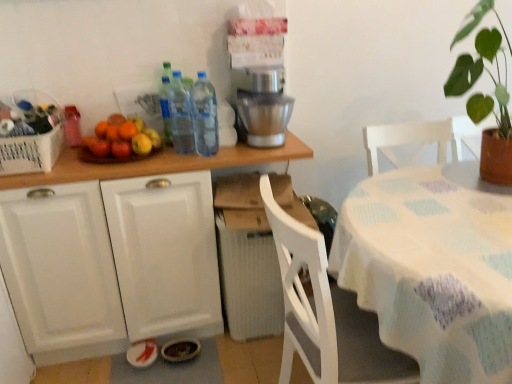
What do you see at coordinates (72, 125) in the screenshot? I see `matte glass bottle at upper left, arranged as the 3th bottle when viewed from the right` at bounding box center [72, 125].

Describe the element at coordinates (180, 116) in the screenshot. I see `translucent plastic bottles at upper center, which is the second bottle in left-to-right order` at that location.

The height and width of the screenshot is (384, 512). What do you see at coordinates (262, 105) in the screenshot?
I see `satin silver coffee machine at upper center` at bounding box center [262, 105].

The image size is (512, 384). I want to click on matte glass bottle at upper left, arranged as the 3th bottle when viewed from the right, so click(x=72, y=125).

Is point (479, 205) positioned behind point (40, 158)?

That is False.

Considering the positions of objects white fabric table at right and white woven basket at left in the image provided, who is more to the left, white fabric table at right or white woven basket at left?

Positioned to the left is white woven basket at left.

Considering the sizes of objects white fabric table at right and white woven basket at left in the image provided, who is shorter, white fabric table at right or white woven basket at left?

With less height is white woven basket at left.

From a real-world perspective, relative to white woven basket at left, is white fabric table at right vertically above or below?

Clearly, from a real-world perspective, white fabric table at right is below white woven basket at left.

Is point (237, 85) positioned in front of point (125, 158)?

No, it is behind (125, 158).

Between satin silver coffee machine at upper center and shiny plastic fruits at center left, which one is positioned behind?

satin silver coffee machine at upper center is further away from the camera.

Can you confirm if satin silver coffee machine at upper center is wider than shiny plastic fruits at center left?

Yes, satin silver coffee machine at upper center is wider than shiny plastic fruits at center left.

At what (x,y) coordinates should I click in order to perform the action: click on fruit in front of the satin silver coffee machine at upper center. Please return your answer as a coordinate pair (x, y). Looking at the image, I should click on (122, 138).

Consider the image. Is white wood cabinet at upper left in contact with transparent plastic bottle at center, the third bottle viewed from the left?

white wood cabinet at upper left is not next to transparent plastic bottle at center, the third bottle viewed from the left, and they're not touching.

Which point is more forward, [121,164] or [203,114]?

The point [121,164] is in front.

From a real-world perspective, which object stands above the other?

From a 3D spatial view, transparent plastic bottle at center, the third bottle viewed from the left, is above.

Find the location of a particular element. Image resolution: width=512 pixels, height=384 pixels. cabinetry that appears on the left of transparent plastic bottle at center, the 1th bottle viewed from the right is located at coordinates (158, 164).

Between satin silver coffee machine at upper center and matte glass bottle at upper left, marked as the first bottle in a left-to-right arrangement, which one has larger width?

satin silver coffee machine at upper center is wider.

Which object is positioned more to the right, satin silver coffee machine at upper center or matte glass bottle at upper left, marked as the first bottle in a left-to-right arrangement?

Positioned to the right is satin silver coffee machine at upper center.

Is satin silver coffee machine at upper center oriented towards matte glass bottle at upper left, marked as the first bottle in a left-to-right arrangement?

No, satin silver coffee machine at upper center is not oriented towards matte glass bottle at upper left, marked as the first bottle in a left-to-right arrangement.

Is the depth of satin silver coffee machine at upper center greater than that of matte glass bottle at upper left, arranged as the 3th bottle when viewed from the right?

No, satin silver coffee machine at upper center is in front of matte glass bottle at upper left, arranged as the 3th bottle when viewed from the right.

Can we say shiny plastic fruits at center left lies outside white wood cabinet at upper left?

Indeed, shiny plastic fruits at center left is completely outside white wood cabinet at upper left.

From the image's perspective, does shiny plastic fruits at center left appear higher than white wood cabinet at upper left?

Yes, from the image's perspective, shiny plastic fruits at center left is over white wood cabinet at upper left.

Are shiny plastic fruits at center left and white wood cabinet at upper left beside each other?

shiny plastic fruits at center left and white wood cabinet at upper left are not in contact.

From a real-world perspective, is shiny plastic fruits at center left physically below white wood cabinet at upper left?

No.

Is white fabric table at right positioned in front of transparent plastic bottle at center, the 1th bottle viewed from the right?

Yes, it is in front of transparent plastic bottle at center, the 1th bottle viewed from the right.

Considering the relative sizes of white fabric table at right and transparent plastic bottle at center, the 1th bottle viewed from the right, in the image provided, is white fabric table at right smaller than transparent plastic bottle at center, the 1th bottle viewed from the right,?

Incorrect, white fabric table at right is not smaller in size than transparent plastic bottle at center, the 1th bottle viewed from the right.

Is point (439, 352) positioned before point (214, 92)?

Yes, point (439, 352) is in front of point (214, 92).

Who is bigger, white wood cabinet at upper left or white woven basket at left?

With larger size is white wood cabinet at upper left.

Is white wood cabinet at upper left closer to camera compared to white woven basket at left?

Yes, it is.

Based on their positions, is white wood cabinet at upper left located to the left or right of white woven basket at left?

white wood cabinet at upper left is to the right of white woven basket at left.

In the scene shown: Considering the sizes of objects white wood cabinet at upper left and white woven basket at left in the image provided, who is thinner, white wood cabinet at upper left or white woven basket at left?

Thinner between the two is white woven basket at left.

The image size is (512, 384). In order to click on basket that is behind the white fabric table at right in this screenshot , I will do `click(31, 152)`.

Where is `coffee machine on the right of shiny plastic fruits at center left`? Image resolution: width=512 pixels, height=384 pixels. coffee machine on the right of shiny plastic fruits at center left is located at coordinates (262, 105).

Looking at the image, which one is located further to white fabric table at right, transparent plastic bottle at center, the 1th bottle viewed from the right, or white woven basket at left?

The object further to white fabric table at right is white woven basket at left.

Considering their positions, is matte glass bottle at upper left, marked as the first bottle in a left-to-right arrangement, positioned further to translucent plastic bottles at upper center, which is the second bottle in left-to-right order, than shiny plastic fruits at center left?

matte glass bottle at upper left, marked as the first bottle in a left-to-right arrangement, is further to translucent plastic bottles at upper center, which is the second bottle in left-to-right order.

Based on the photo, when comparing their distances from shiny plastic fruits at center left, does satin silver coffee machine at upper center or white wood cabinet at upper left seem closer?

white wood cabinet at upper left is positioned closer to the anchor shiny plastic fruits at center left.

Considering their positions, is translucent plastic bottles at upper center, which is the second bottle in left-to-right order, positioned further to white fabric table at right than transparent plastic bottle at center, the third bottle viewed from the left?

translucent plastic bottles at upper center, which is the second bottle in left-to-right order, is positioned further to the anchor white fabric table at right.

From the image, which object appears to be nearer to matte glass bottle at upper left, marked as the first bottle in a left-to-right arrangement, white fabric table at right or white woven basket at left?

white woven basket at left.

When comparing their distances from satin silver coffee machine at upper center, does matte glass bottle at upper left, marked as the first bottle in a left-to-right arrangement, or translucent plastic bottles at upper center, which is the second bottle in left-to-right order, seem closer?

Among the two, translucent plastic bottles at upper center, which is the second bottle in left-to-right order, is located nearer to satin silver coffee machine at upper center.

From the image, which object appears to be nearer to white woven basket at left, matte glass bottle at upper left, arranged as the 3th bottle when viewed from the right, or shiny plastic fruits at center left?

Among the two, shiny plastic fruits at center left is located nearer to white woven basket at left.

When comparing their distances from white fabric table at right, does white woven basket at left or shiny plastic fruits at center left seem further?

The object further to white fabric table at right is white woven basket at left.

You are a GUI agent. You are given a task and a screenshot of the screen. Output one action in this format:
    pyautogui.click(x=<x>, y=<y>)
    Task: Click on the fruit between white woven basket at left and satin silver coffee machine at upper center
    This screenshot has width=512, height=384.
    Given the screenshot: What is the action you would take?
    [122, 138]

Where is `bottle between shiny plastic fruits at center left and transparent plastic bottle at center, the 1th bottle viewed from the right`? bottle between shiny plastic fruits at center left and transparent plastic bottle at center, the 1th bottle viewed from the right is located at coordinates (180, 116).

What are the coordinates of `fruit between matte glass bottle at upper left, arranged as the 3th bottle when viewed from the right, and white wood cabinet at upper left from top to bottom` in the screenshot? It's located at (122, 138).

At what (x,y) coordinates should I click in order to perform the action: click on coffee machine situated between translucent plastic bottles at upper center, which is the second bottle in left-to-right order, and white fabric table at right from left to right. Please return your answer as a coordinate pair (x, y). The width and height of the screenshot is (512, 384). Looking at the image, I should click on (262, 105).